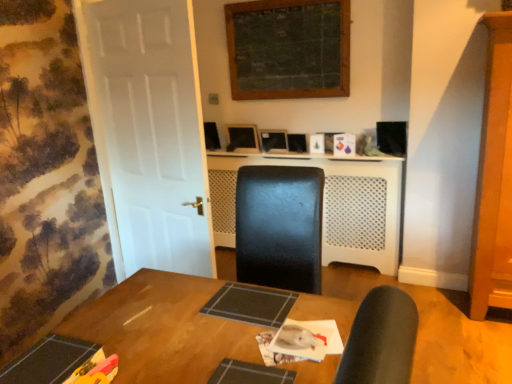
Question: Is matte black monitor at center facing towards white matte door at left?

Choices:
 (A) no
 (B) yes

Answer: (B)

Question: Can you confirm if matte black monitor at center is shorter than white matte door at left?

Choices:
 (A) no
 (B) yes

Answer: (B)

Question: Does matte black monitor at center contain white matte door at left?

Choices:
 (A) yes
 (B) no

Answer: (B)

Question: Is the depth of matte black monitor at center less than that of white matte door at left?

Choices:
 (A) yes
 (B) no

Answer: (B)

Question: Considering the relative positions of matte black monitor at center and white matte door at left in the image provided, is matte black monitor at center to the right of white matte door at left from the viewer's perspective?

Choices:
 (A) yes
 (B) no

Answer: (A)

Question: Can you confirm if matte black monitor at center is smaller than white matte door at left?

Choices:
 (A) no
 (B) yes

Answer: (B)

Question: From a real-world perspective, is matte black monitor at center under white perforated plastic at center?

Choices:
 (A) yes
 (B) no

Answer: (B)

Question: Is matte black monitor at center aimed at white perforated plastic at center?

Choices:
 (A) no
 (B) yes

Answer: (A)

Question: Is matte black monitor at center facing away from white perforated plastic at center?

Choices:
 (A) no
 (B) yes

Answer: (A)

Question: Is matte black monitor at center to the left of white perforated plastic at center from the viewer's perspective?

Choices:
 (A) yes
 (B) no

Answer: (A)

Question: Can you confirm if matte black monitor at center is thinner than white perforated plastic at center?

Choices:
 (A) no
 (B) yes

Answer: (B)

Question: Is matte black monitor at center shorter than white perforated plastic at center?

Choices:
 (A) yes
 (B) no

Answer: (A)

Question: Is white perforated plastic at center smaller than matte black monitor at center?

Choices:
 (A) no
 (B) yes

Answer: (A)